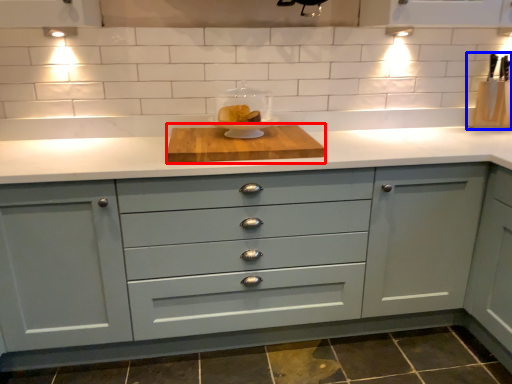
Question: Among these objects, which one is nearest to the camera, cutting board (highlighted by a red box) or appliance (highlighted by a blue box)?

Choices:
 (A) cutting board
 (B) appliance

Answer: (A)